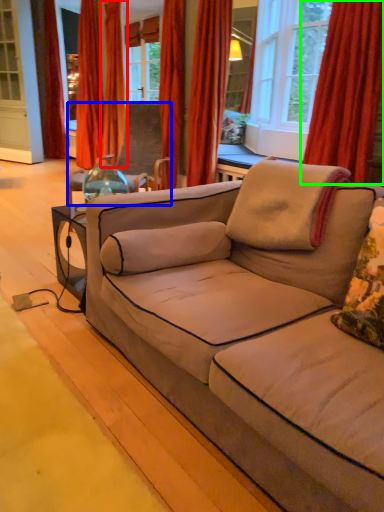
Question: Which is farther away from curtain (highlighted by a red box)? chair (highlighted by a blue box) or curtain (highlighted by a green box)?

Choices:
 (A) chair
 (B) curtain

Answer: (B)